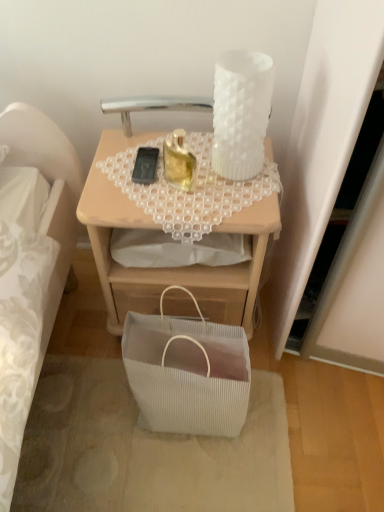
Image resolution: width=384 pixels, height=512 pixels. Identify the location of vacant space situated on the left part of black matte mobile phone at center. (110, 162).